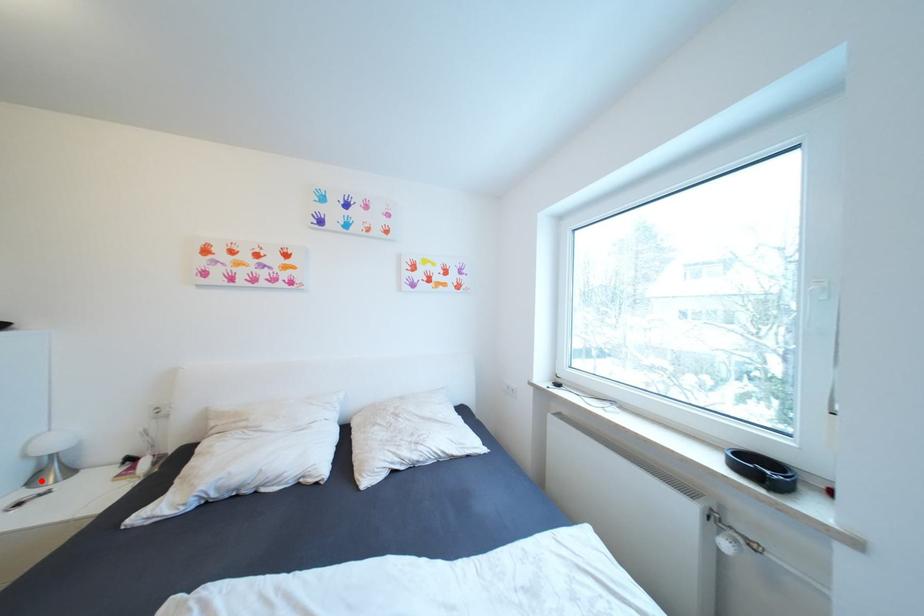
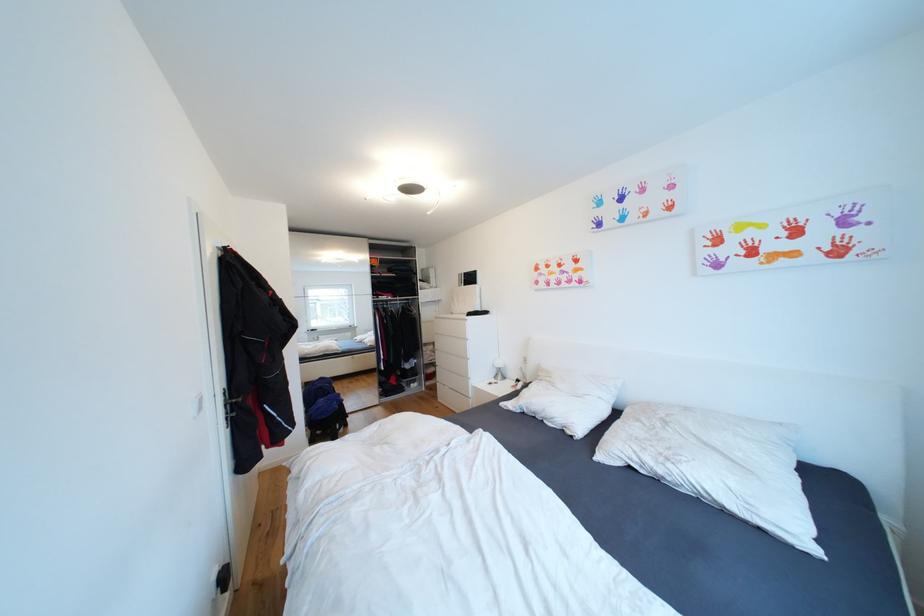
In the second image, find the point that corresponds to the highlighted location in the first image.

(503, 378)